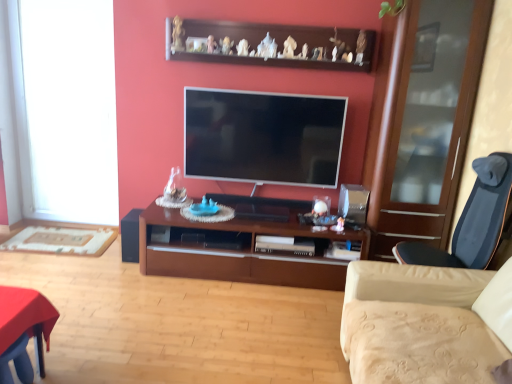
Question: From the image's perspective, is black matte speaker at lower left located above or below white glass window at left?

Choices:
 (A) below
 (B) above

Answer: (A)

Question: Is black matte speaker at lower left taller or shorter than white glass window at left?

Choices:
 (A) short
 (B) tall

Answer: (A)

Question: Estimate the real-world distances between objects in this image. Which object is closer to the transparent glass cabinet at right?

Choices:
 (A) brown wood cabinet at center
 (B) dark blue fabric chair at right
 (C) flat screen tv at center
 (D) wooden shelf at upper center
 (E) black matte speaker at lower left

Answer: (B)

Question: Which object is positioned closest to the black matte speaker at lower left?

Choices:
 (A) dark blue fabric chair at right
 (B) beige fabric studio couch at lower right
 (C) wooden shelf at upper center
 (D) white glass window at left
 (E) transparent glass cabinet at right

Answer: (D)